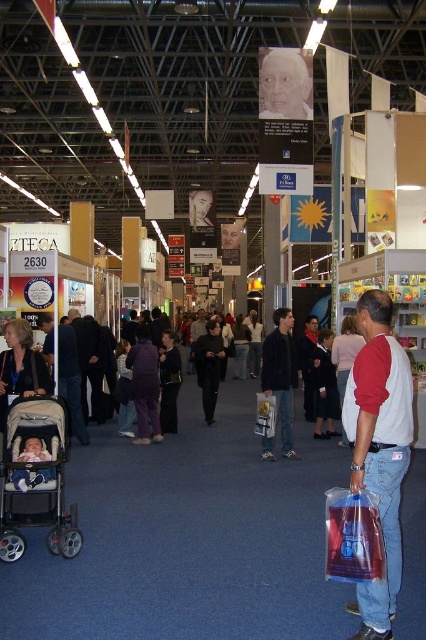
Question: Considering the real-world distances, which object is closest to the matte black stroller at left?

Choices:
 (A) blue fabric baby carriage at lower left
 (B) white/red long-sleeved shirt at right
 (C) smooth gray face at upper center
 (D) dark gray pants at center

Answer: (D)

Question: Estimate the real-world distances between objects in this image. Which object is closer to the dark blue jacket at center?

Choices:
 (A) blue fabric baby carriage at lower left
 (B) smooth gray face at upper center
 (C) dark gray pants at center
 (D) matte black stroller at left

Answer: (D)

Question: Which of these objects is positioned farthest from the dark gray pants at center?

Choices:
 (A) dark blue jacket at center
 (B) white/red long-sleeved shirt at right
 (C) blue fabric baby carriage at lower left
 (D) beige fabric stroller at lower left

Answer: (B)

Question: Is smooth gray face at upper center thinner than dark blue jacket at center?

Choices:
 (A) yes
 (B) no

Answer: (B)

Question: Where is matte black stroller at left located in relation to blue fabric baby carriage at lower left in the image?

Choices:
 (A) above
 (B) below

Answer: (A)

Question: Does beige fabric stroller at lower left have a greater width compared to blue fabric baby carriage at lower left?

Choices:
 (A) yes
 (B) no

Answer: (A)